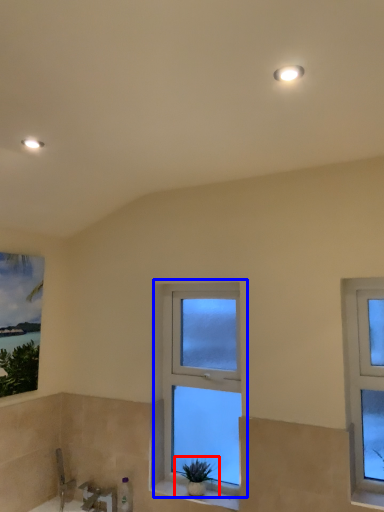
Question: Which point is closer to the camera, houseplant (highlighted by a red box) or window (highlighted by a blue box)?

Choices:
 (A) houseplant
 (B) window

Answer: (A)